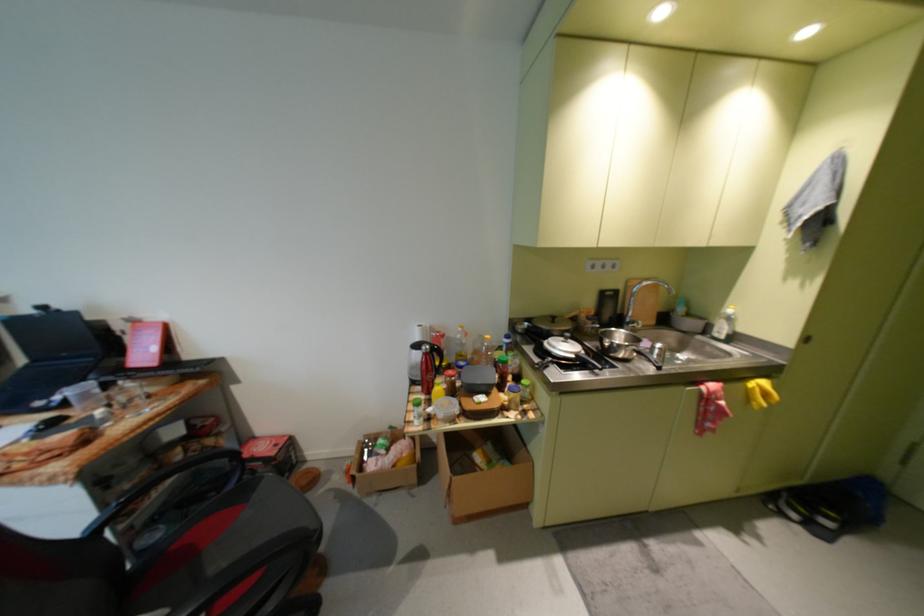
You are a GUI agent. You are given a task and a screenshot of the screen. Output one action in this format:
    pyautogui.click(x=<x>, y=<y>)
    Task: Click on the white dish soap bottle
    Image resolution: width=924 pixels, height=616 pixels.
    Given the screenshot: What is the action you would take?
    pyautogui.click(x=724, y=325)